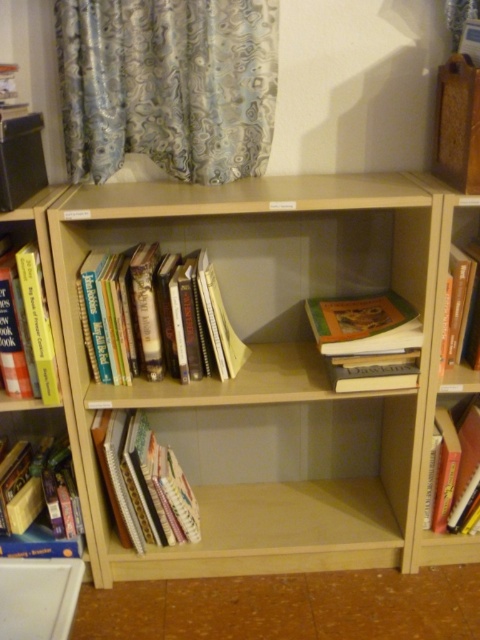
You are organizing the beige wooden bookshelf and notice two items on the middle shelf. You see the hardcover books at lower left and the hardcover book at lower left. Which one is positioned higher up?

The hardcover books at lower left is above the hardcover book at lower left.

You are a librarian trying to organize the bookshelf. You notice that the point at coordinates (156, 316) is where the hardcover books are located. If you want to place a new book at this exact point, what type of books are already occupying that spot?

The point at coordinates (156, 316) is occupied by hardcover books.

You are standing in front of the beige wooden bookshelf and want to reach the hardcover books at center. Considering your height, which is 5 feet 6 inches, can you comfortably reach them without needing a stool?

The hardcover books at center are 4.26 feet from the camera. Since 4.26 feet is approximately 51 inches, and your height is 5 feet 6 inches, which is 66 inches, you can comfortably reach them without needing a stool.